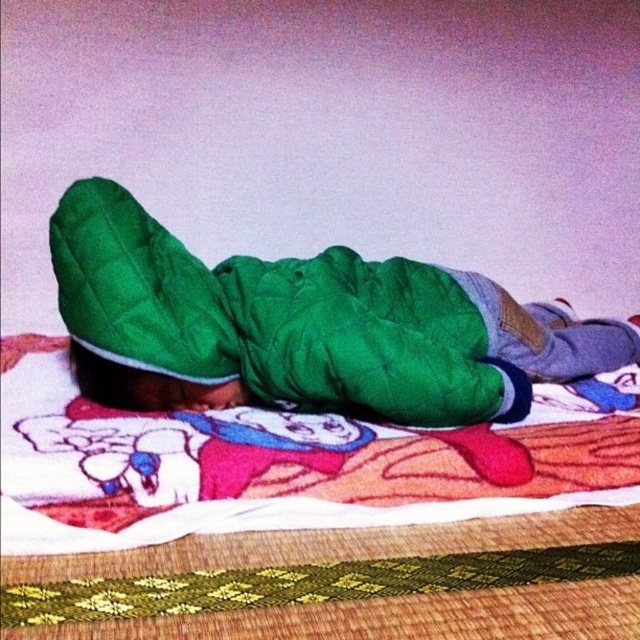
You are a delivery person who needs to deliver a package to the person in the bed. The package is for the person inside the green quilted jacket at center and the green quilted fabric at center. However, you can only deliver to one of them. Based on their positions, which one is more accessible for you to hand the package to?

The green quilted jacket at center is in front of the green quilted fabric at center, so the package should be delivered to the green quilted jacket at center as it is more accessible.